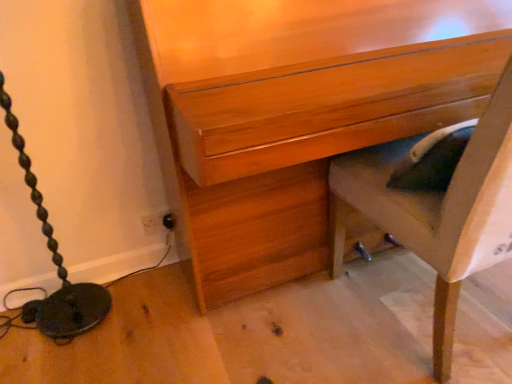
Question: Does wooden chest of drawers at center have a lesser width compared to wooden chair at lower right?

Choices:
 (A) no
 (B) yes

Answer: (B)

Question: Is wooden chest of drawers at center surrounding wooden chair at lower right?

Choices:
 (A) no
 (B) yes

Answer: (B)

Question: Is wooden chest of drawers at center bigger than wooden chair at lower right?

Choices:
 (A) no
 (B) yes

Answer: (B)

Question: Considering the relative sizes of wooden chest of drawers at center and wooden chair at lower right in the image provided, is wooden chest of drawers at center shorter than wooden chair at lower right?

Choices:
 (A) no
 (B) yes

Answer: (A)

Question: Considering the relative positions of wooden chest of drawers at center and wooden chair at lower right in the image provided, is wooden chest of drawers at center behind wooden chair at lower right?

Choices:
 (A) yes
 (B) no

Answer: (A)

Question: Is wooden chest of drawers at center facing towards wooden chair at lower right?

Choices:
 (A) no
 (B) yes

Answer: (B)

Question: Does wooden chair at lower right have a larger size compared to wooden chest of drawers at center?

Choices:
 (A) yes
 (B) no

Answer: (B)

Question: Is wooden chair at lower right positioned with its back to wooden chest of drawers at center?

Choices:
 (A) yes
 (B) no

Answer: (A)

Question: Would you say wooden chest of drawers at center is part of wooden chair at lower right's contents?

Choices:
 (A) no
 (B) yes

Answer: (A)

Question: Does wooden chair at lower right have a lesser width compared to wooden chest of drawers at center?

Choices:
 (A) yes
 (B) no

Answer: (B)

Question: From the image's perspective, does wooden chair at lower right appear lower than wooden chest of drawers at center?

Choices:
 (A) no
 (B) yes

Answer: (B)

Question: Considering the relative positions of wooden chair at lower right and wooden chest of drawers at center in the image provided, is wooden chair at lower right to the left of wooden chest of drawers at center from the viewer's perspective?

Choices:
 (A) yes
 (B) no

Answer: (B)

Question: In terms of width, does wooden chest of drawers at center look wider or thinner when compared to wooden chair at lower right?

Choices:
 (A) wide
 (B) thin

Answer: (B)